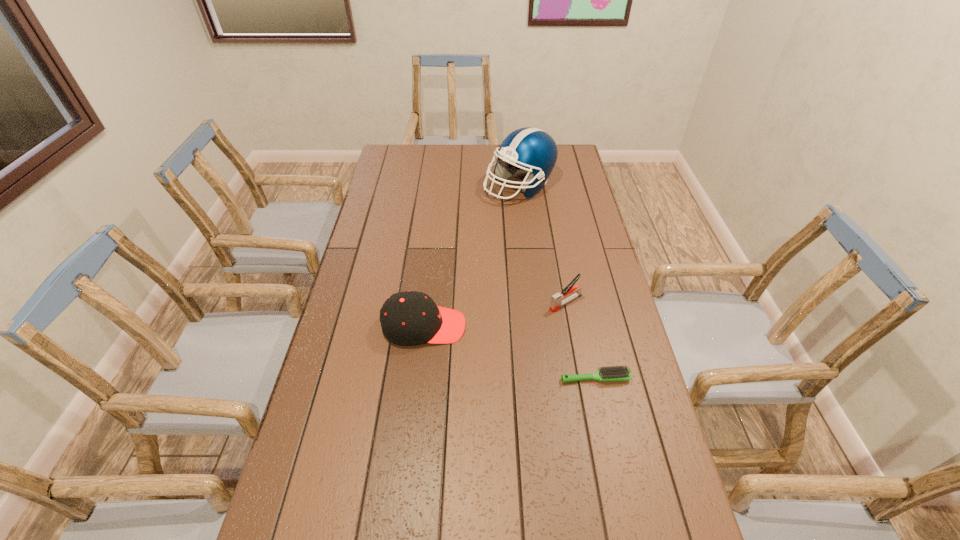
Identify the location of free location at the far edge. (476, 148).

Find the location of `vacant space at the left edge of the desktop`. vacant space at the left edge of the desktop is located at coordinates tap(396, 205).

This screenshot has height=540, width=960. In order to click on free space at the right edge of the desktop in this screenshot , I will do `click(585, 310)`.

You are a GUI agent. You are given a task and a screenshot of the screen. Output one action in this format:
    pyautogui.click(x=<x>, y=<y>)
    Task: Click on the vacant space in between the farthest object and the hairbrush
    The image size is (960, 540).
    Given the screenshot: What is the action you would take?
    pyautogui.click(x=558, y=282)

Image resolution: width=960 pixels, height=540 pixels. What are the coordinates of `vacant point located between the nearest object and the leftmost object` in the screenshot? It's located at (510, 352).

Locate an element on the screen. The image size is (960, 540). empty location between the farthest object and the cap is located at coordinates (471, 256).

Find the location of a particular element. Image resolution: width=960 pixels, height=540 pixels. blank region between the cap and the stapler is located at coordinates (495, 314).

Locate an element on the screen. The image size is (960, 540). unoccupied area between the stapler and the football helmet is located at coordinates (542, 244).

You are a GUI agent. You are given a task and a screenshot of the screen. Output one action in this format:
    pyautogui.click(x=<x>, y=<y>)
    Task: Click on the vacant area between the hairbrush and the leftmost object
    This screenshot has height=540, width=960.
    Given the screenshot: What is the action you would take?
    pyautogui.click(x=510, y=352)

Identify the location of unoccupied area between the leftmost object and the farthest object. Image resolution: width=960 pixels, height=540 pixels. (471, 256).